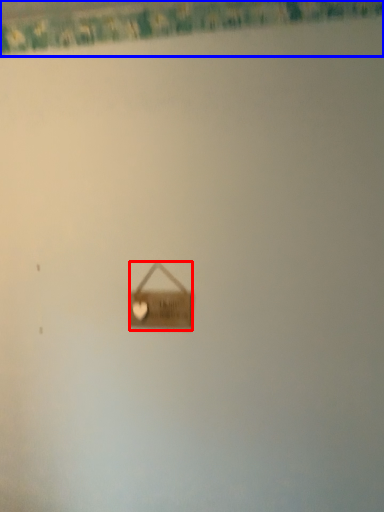
Question: Which point is further to the camera, handbag (highlighted by a red box) or curtain (highlighted by a blue box)?

Choices:
 (A) handbag
 (B) curtain

Answer: (A)